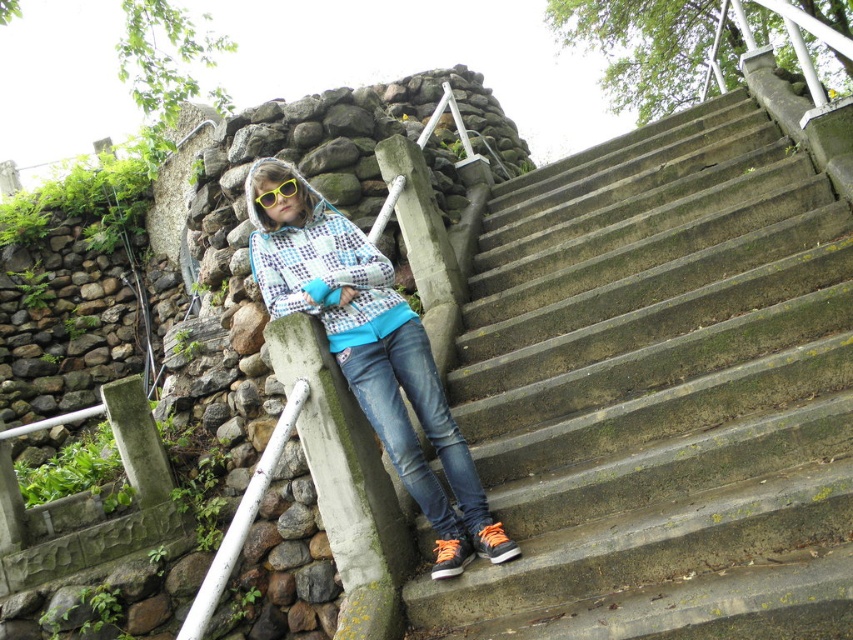
From the picture: You are a drone operator trying to navigate between two points marked in the image. The points are labeled as point (369, 323) and point (268, 202). Based on the scene, which point is closer to you?

Point (369, 323) is further to the viewer than point (268, 202), so the point closer to you is point (268, 202).

You are a painter who needs to place a ladder against the concrete stairs at center and the plaid fabric at center. Which object should you choose to place the ladder against?

You should place the ladder against the concrete stairs at center because it is much taller than the plaid fabric at center, providing a stable and safe surface for the ladder.